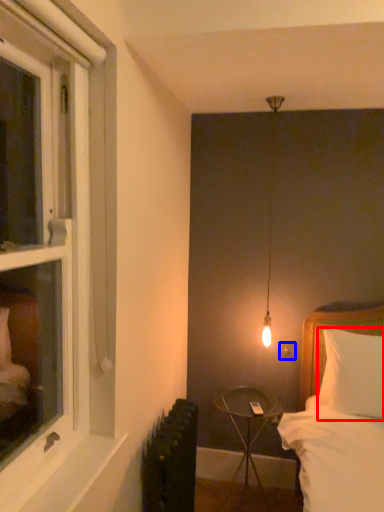
Question: Which object is closer to the camera taking this photo, pillow (highlighted by a red box) or electric outlet (highlighted by a blue box)?

Choices:
 (A) pillow
 (B) electric outlet

Answer: (A)